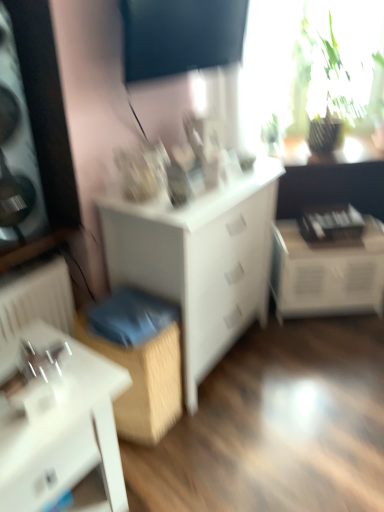
Where is `vacant space in front of wooden box at lower center`? vacant space in front of wooden box at lower center is located at coordinates (156, 467).